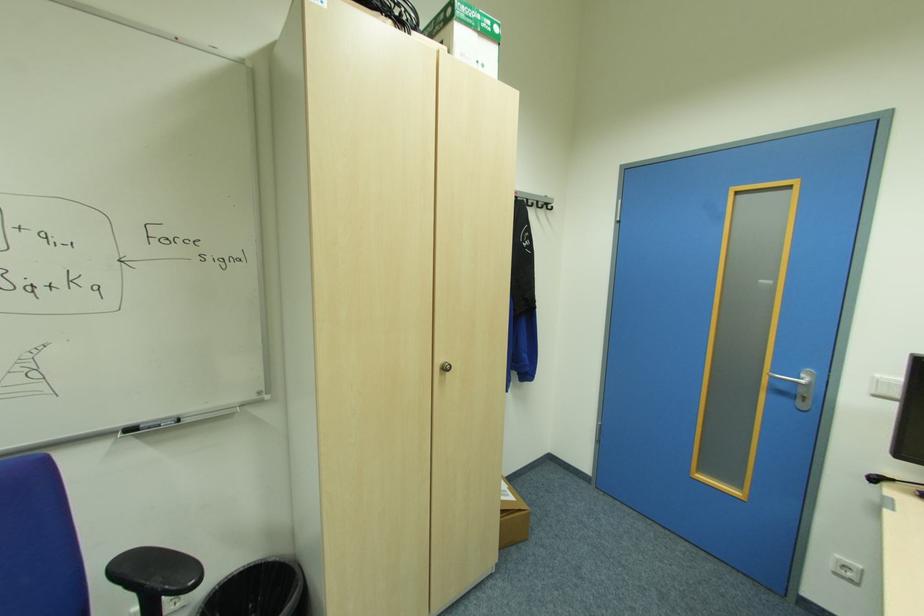
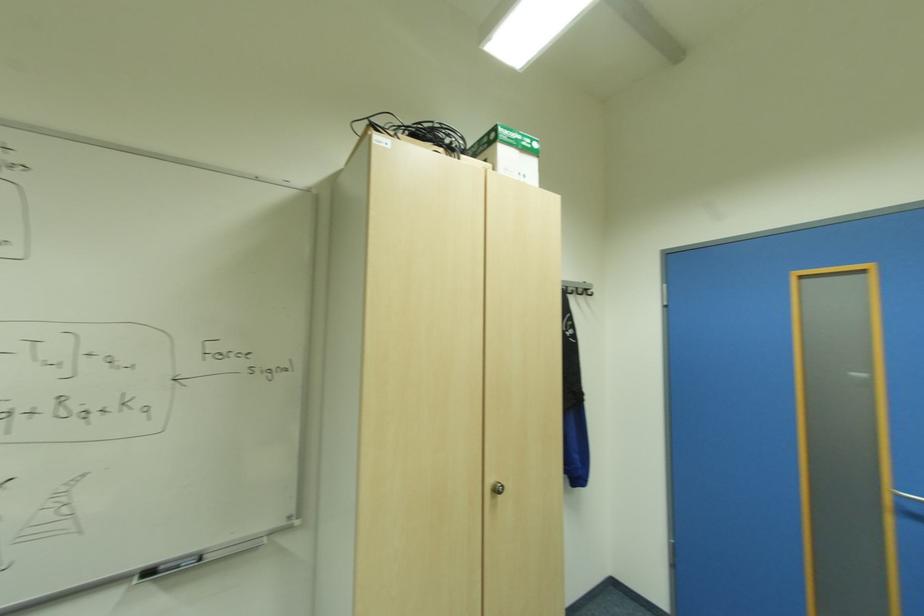
Question: Based on the continuous images, in which direction is the camera rotating? Reply with the corresponding letter.

Choices:
 (A) Left
 (B) Right
 (C) Up
 (D) Down

Answer: (C)